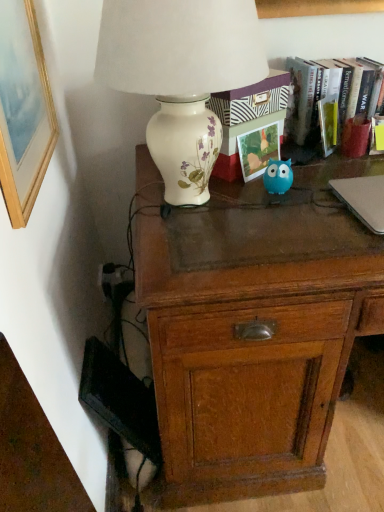
Question: Considering the relative sizes of hardcover book at upper right and blue rubber toy at center in the image provided, is hardcover book at upper right bigger than blue rubber toy at center?

Choices:
 (A) no
 (B) yes

Answer: (B)

Question: From the image's perspective, does hardcover book at upper right appear lower than blue rubber toy at center?

Choices:
 (A) no
 (B) yes

Answer: (A)

Question: Does hardcover book at upper right have a lesser width compared to blue rubber toy at center?

Choices:
 (A) yes
 (B) no

Answer: (B)

Question: Is hardcover book at upper right facing away from blue rubber toy at center?

Choices:
 (A) no
 (B) yes

Answer: (A)

Question: Considering the relative positions of hardcover book at upper right and blue rubber toy at center in the image provided, is hardcover book at upper right to the left of blue rubber toy at center from the viewer's perspective?

Choices:
 (A) no
 (B) yes

Answer: (A)

Question: In terms of width, does porcelain floral lamp at upper left look wider or thinner when compared to silver metallic laptop at right?

Choices:
 (A) thin
 (B) wide

Answer: (B)

Question: Considering the positions of porcelain floral lamp at upper left and silver metallic laptop at right in the image, is porcelain floral lamp at upper left taller or shorter than silver metallic laptop at right?

Choices:
 (A) short
 (B) tall

Answer: (B)

Question: Considering the relative positions of porcelain floral lamp at upper left and silver metallic laptop at right in the image provided, is porcelain floral lamp at upper left to the left or to the right of silver metallic laptop at right?

Choices:
 (A) right
 (B) left

Answer: (B)

Question: From a real-world perspective, relative to silver metallic laptop at right, is porcelain floral lamp at upper left vertically above or below?

Choices:
 (A) below
 (B) above

Answer: (B)

Question: Is blue rubber toy at center situated inside porcelain floral lamp at upper left or outside?

Choices:
 (A) outside
 (B) inside

Answer: (A)

Question: Is blue rubber toy at center wider or thinner than porcelain floral lamp at upper left?

Choices:
 (A) thin
 (B) wide

Answer: (A)

Question: From a real-world perspective, is blue rubber toy at center physically located above or below porcelain floral lamp at upper left?

Choices:
 (A) below
 (B) above

Answer: (A)

Question: Is point (289, 180) closer or farther from the camera than point (203, 183)?

Choices:
 (A) closer
 (B) farther

Answer: (B)

Question: From a real-world perspective, is wooden picture frame at upper left above or below silver metallic laptop at right?

Choices:
 (A) below
 (B) above

Answer: (B)

Question: Looking at their shapes, would you say wooden picture frame at upper left is wider or thinner than silver metallic laptop at right?

Choices:
 (A) thin
 (B) wide

Answer: (A)